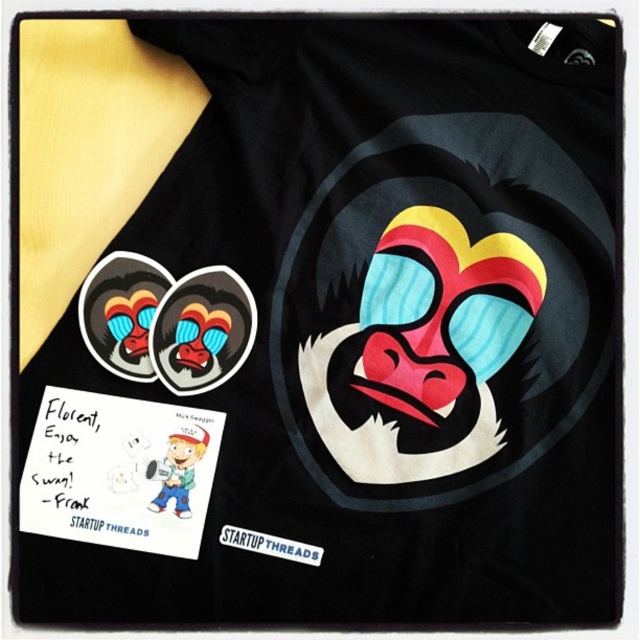
You are designing a new tshirt and want to place a matte rubber monkey face at upper left and a white matte sticker at center. Based on the existing design, which object has a larger width?

The matte rubber monkey face at upper left has a larger width than the white matte sticker at center.

You are designing a t shirt and want to ensure that the matte rubber monkey face at upper left and the white matte sticker at center are placed correctly. According to the image, which object is bigger?

The matte rubber monkey face at upper left is larger than the white matte sticker at center.